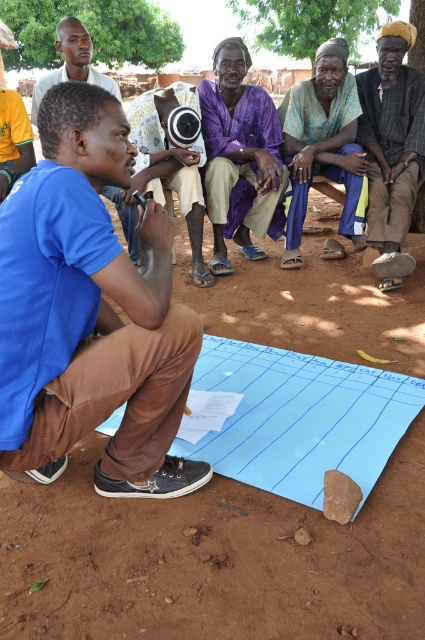
You are a photographer standing at the position of the man with the microphone. You want to take a photo of the group and the brown woven cloth at right. What is the minimum distance you need to move forward to ensure both are in frame?

The minimum distance to move forward is 3.24 meters minus the current distance between the group and the cloth. However, without knowing the current distance, it is impossible to calculate the exact required movement. Please provide more information.

You are a photographer who needs to place a blue fabric at center and a matte black camera at center in a way that they are both visible in the photo. Given their sizes, which object should be placed closer to the camera lens to ensure both are fully visible?

The blue fabric at center is smaller than the matte black camera at center. To ensure both are fully visible in the photo, the smaller blue fabric at center should be placed closer to the camera lens so that its size in the frame matches the larger matte black camera at center.

You are a photographer trying to capture a closeup of the brown rough rock at lower center without including the brown woven cloth at right in the frame. Based on their positions, is this possible?

The brown woven cloth at right is positioned on the right side of brown rough rock at lower center. Since the cloth is to the right of the rock, you can adjust your camera angle to the left side of the rock to exclude the cloth from the frame.